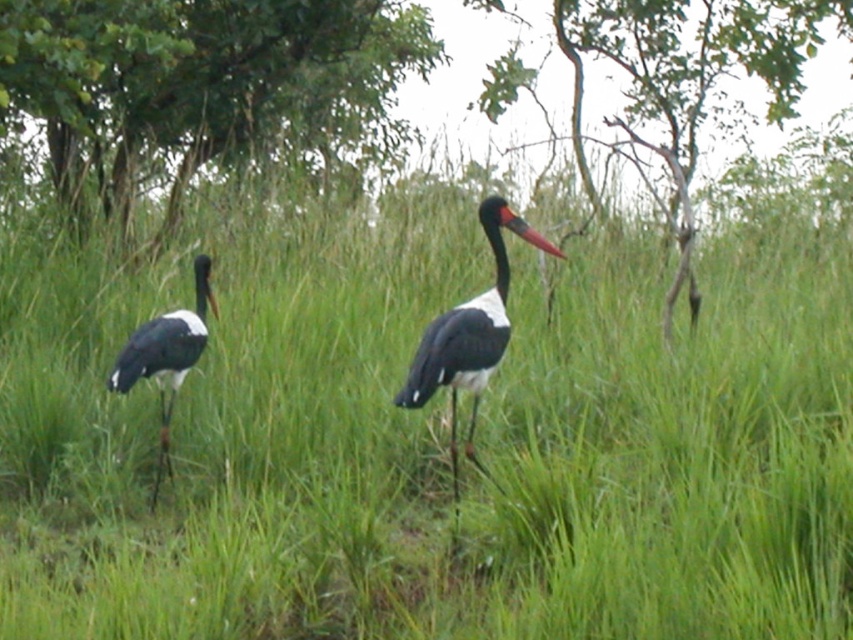
Is green leafy tree at upper center above smooth bark tree at upper center?

No.

Between point (309, 58) and point (695, 83), which one is positioned in front?

Point (309, 58) is more forward.

This screenshot has width=853, height=640. In order to click on green leafy tree at upper center in this screenshot , I will do `click(196, 84)`.

Does point (648, 140) come farther from viewer compared to point (161, 412)?

Yes.

Does smooth bark tree at upper center appear over black glossy stork at left?

Yes.

Image resolution: width=853 pixels, height=640 pixels. What do you see at coordinates (688, 81) in the screenshot?
I see `smooth bark tree at upper center` at bounding box center [688, 81].

Find the location of a particular element. The image size is (853, 640). smooth bark tree at upper center is located at coordinates (688, 81).

Is black glossy stork at center closer to camera compared to black glossy stork at left?

Yes, black glossy stork at center is in front of black glossy stork at left.

Based on the photo, who is taller, black glossy stork at center or black glossy stork at left?

black glossy stork at center is taller.

Describe the element at coordinates (469, 330) in the screenshot. I see `black glossy stork at center` at that location.

This screenshot has width=853, height=640. I want to click on black glossy stork at center, so click(x=469, y=330).